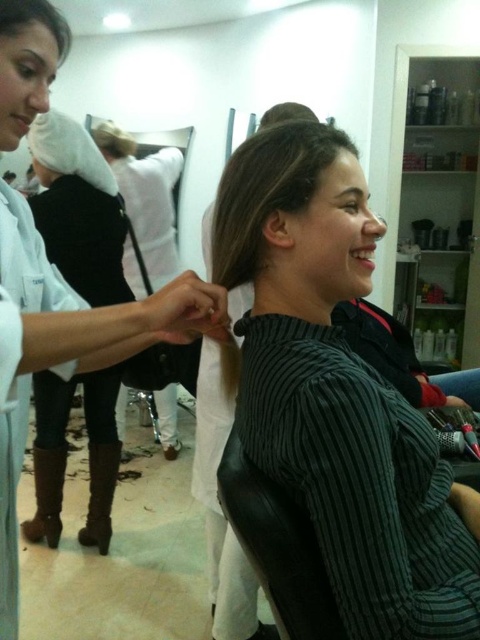
Question: Does black corduroy shirt at center have a larger size compared to matte black hand at lower right?

Choices:
 (A) yes
 (B) no

Answer: (A)

Question: Which point is closer to the camera taking this photo?

Choices:
 (A) (278, 195)
 (B) (213, 260)
 (C) (283, 115)
 (D) (2, 16)

Answer: (D)

Question: Which point is farther to the camera?

Choices:
 (A) (107, 156)
 (B) (308, 163)

Answer: (A)

Question: Is black striped shirt at center closer to camera compared to white fabric at upper left?

Choices:
 (A) no
 (B) yes

Answer: (B)

Question: Which point is farther from the camera taking this photo?

Choices:
 (A) (58, 33)
 (B) (336, 497)

Answer: (A)

Question: From the image, what is the correct spatial relationship of black corduroy shirt at center in relation to brown matte hair at upper center?

Choices:
 (A) below
 (B) above

Answer: (A)